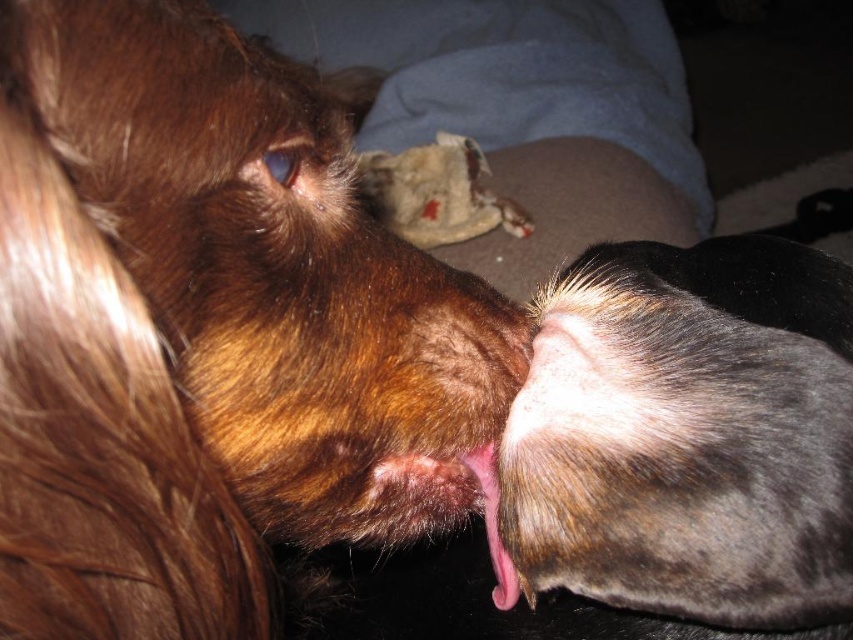
Looking at this image, who is taller, fuzzy brown dog at lower right or pink flesh at center?

Standing taller between the two is fuzzy brown dog at lower right.

Is fuzzy brown dog at lower right thinner than pink flesh at center?

No, fuzzy brown dog at lower right is not thinner than pink flesh at center.

Is point (550, 333) in front of point (503, 604)?

Yes, it is.

The height and width of the screenshot is (640, 853). What are the coordinates of `fuzzy brown dog at lower right` in the screenshot? It's located at [x=688, y=433].

Does brown furry dog at upper left have a smaller size compared to fuzzy brown dog at lower right?

Incorrect, brown furry dog at upper left is not smaller in size than fuzzy brown dog at lower right.

Does brown furry dog at upper left appear under fuzzy brown dog at lower right?

Actually, brown furry dog at upper left is above fuzzy brown dog at lower right.

What do you see at coordinates (218, 300) in the screenshot? The image size is (853, 640). I see `brown furry dog at upper left` at bounding box center [218, 300].

This screenshot has height=640, width=853. Find the location of `brown furry dog at upper left`. brown furry dog at upper left is located at coordinates (218, 300).

Identify the location of brown furry dog at upper left. The image size is (853, 640). (218, 300).

Does point (165, 412) come closer to viewer compared to point (473, 461)?

Yes.

The image size is (853, 640). What are the coordinates of `brown furry dog at upper left` in the screenshot? It's located at (218, 300).